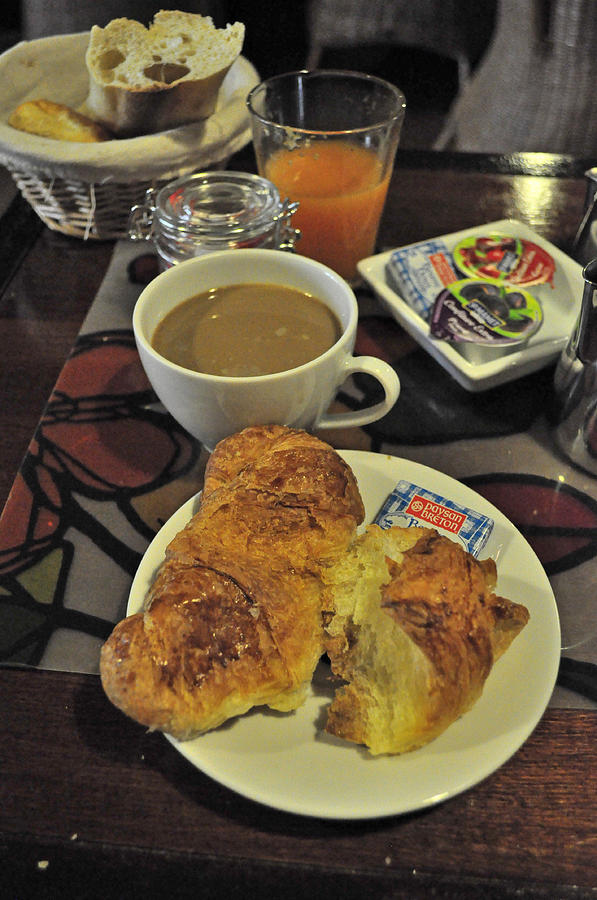
I want to click on half pieces of bread in basket, so (x=152, y=72), (x=64, y=126).